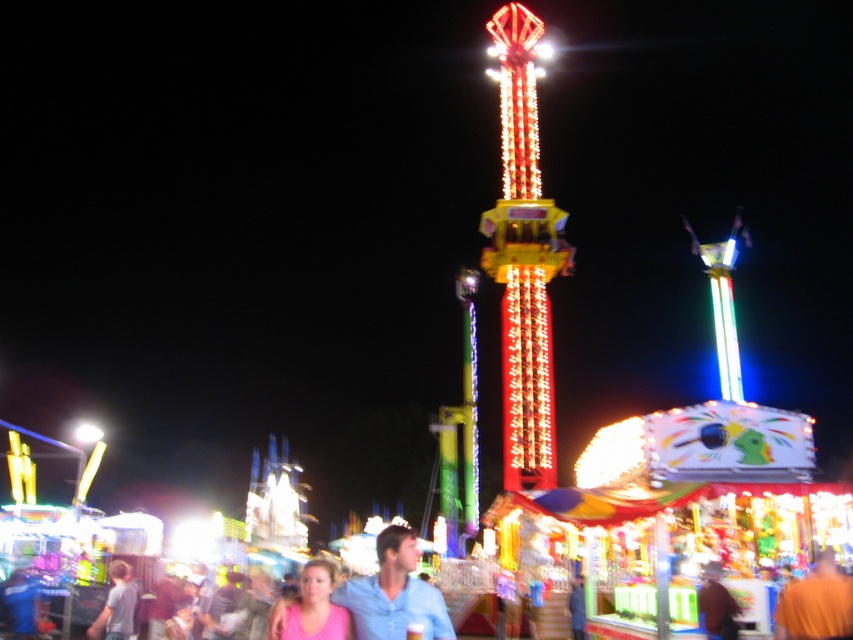
Is orange cloth at center wider than pink matte shirt at lower center?

In fact, orange cloth at center might be narrower than pink matte shirt at lower center.

Which is more to the right, orange cloth at center or pink matte shirt at lower center?

orange cloth at center is more to the right.

Is point (840, 588) in front of point (325, 566)?

Yes, point (840, 588) is closer to viewer.

You are a GUI agent. You are given a task and a screenshot of the screen. Output one action in this format:
    pyautogui.click(x=<x>, y=<y>)
    Task: Click on the orange cloth at center
    This screenshot has width=853, height=640.
    Given the screenshot: What is the action you would take?
    pyautogui.click(x=816, y=604)

Between blue cotton shirt at center and orange cloth at center, which one is positioned higher?

orange cloth at center is higher up.

Does blue cotton shirt at center have a larger size compared to orange cloth at center?

Yes.

Locate an element on the screen. Image resolution: width=853 pixels, height=640 pixels. blue cotton shirt at center is located at coordinates (393, 593).

Does blue cotton shirt at center have a greater height compared to light blue shirt at lower left?

Yes.

In the scene shown: Does blue cotton shirt at center have a smaller size compared to light blue shirt at lower left?

Yes, blue cotton shirt at center is smaller than light blue shirt at lower left.

Is point (418, 582) positioned behind point (123, 596)?

No, (418, 582) is in front of (123, 596).

Where is `blue cotton shirt at center`? blue cotton shirt at center is located at coordinates (393, 593).